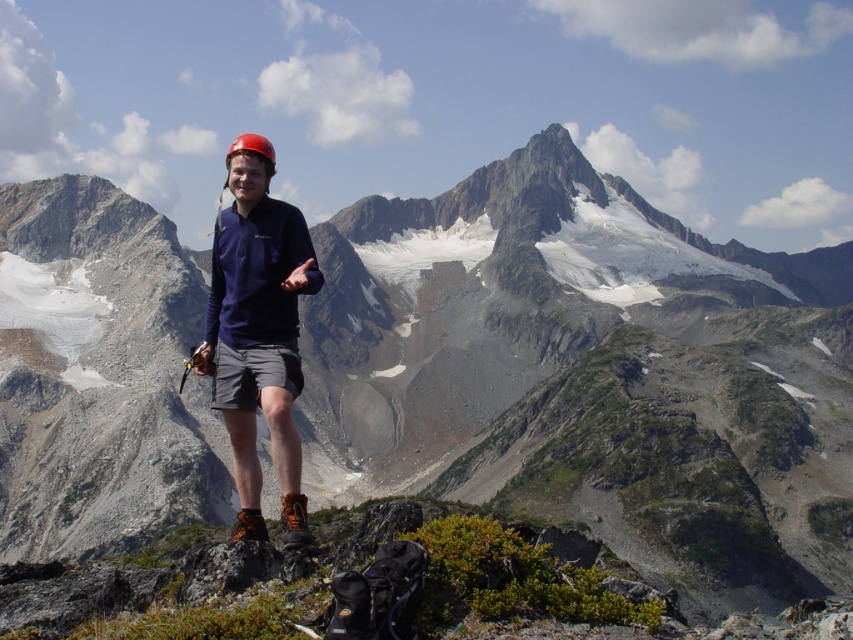
You are a hiker who needs to check your clothing layers. Based on the image, which clothing item is closer to your lower body? The options are the matte blue shirt at center and the gray fabric shorts at center.

The gray fabric shorts at center are closer to the lower body because the matte blue shirt at center is positioned under it, meaning the shorts are on top.

You are a hiker who needs to decide which clothing item to adjust first based on the cold weather. Since you can only adjust one item at a time, which one should you prioritize adjusting, the matte blue shirt at center or the gray fabric shorts at center, considering their sizes?

The matte blue shirt at center is larger in size than the gray fabric shorts at center, so you should prioritize adjusting the matte blue shirt at center first because larger items like the shirt might offer better insulation and coverage, making it more effective in retaining body heat.